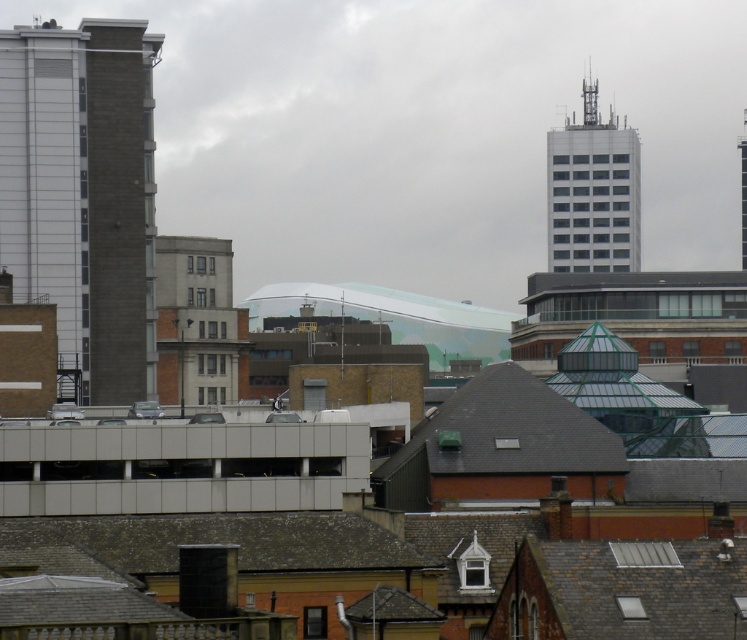
You are standing in the city and looking at the scene. Which of the two roofs, the brown shingles at lower center or the gray slate roof at center, would appear larger to you?

The brown shingles at lower center would appear larger because it is closer to the viewer than the gray slate roof at center.

You are standing at the point marked as point (223, 540) in the cityscape image. Looking around, you notice brown shingles at lower center. What is the texture of the surface you are standing on?

The point (223, 540) corresponds to brown shingles at lower center, which have a rough and weathered texture.